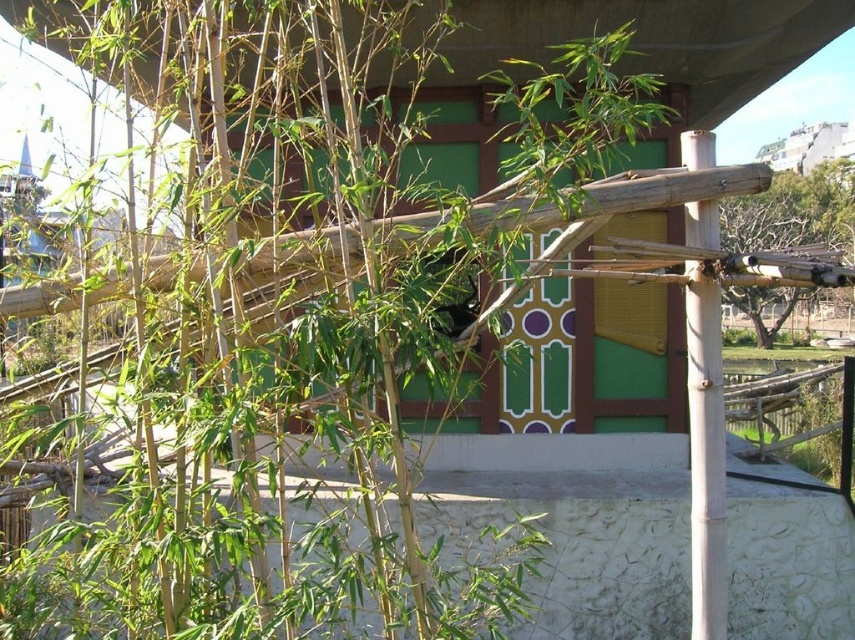
You are a painter setting up your easel to capture the scene of the smooth bamboo pole at right and the bare wood structure at right. Which object should you focus on first if you want to paint the narrower one?

The smooth bamboo pole at right has a lesser width compared to the bare wood structure at right, so you should focus on the smooth bamboo pole at right first.

You are a visitor at the zoo and want to take a photo of the smooth bamboo pole at right and the bare wood structure at right. Which object should you focus on first if you want to capture both in the same frame without moving your camera?

You should focus on the bare wood structure at right first because it is larger than the smooth bamboo pole at right, allowing it to be more prominent in the frame while still including the smaller bamboo pole.

You are standing in the outdoor enclosure and want to take a photo of the vibrant green pavilion with its intricate patterns. However, there is a smooth bamboo pole at right blocking your view. Based on its 2D location coordinates, can you estimate whether the pole is closer to the pavilion or closer to you?

The smooth bamboo pole at right is located at coordinates point (705, 454). Since the y coordinate 0.826 is closer to 1, which typically represents the bottom of the image frame, this indicates the pole is positioned lower in the image. In many image coordinate systems, lower positions correspond to being closer to the viewer. Therefore, the smooth bamboo pole at right is closer to you than the pavilion.